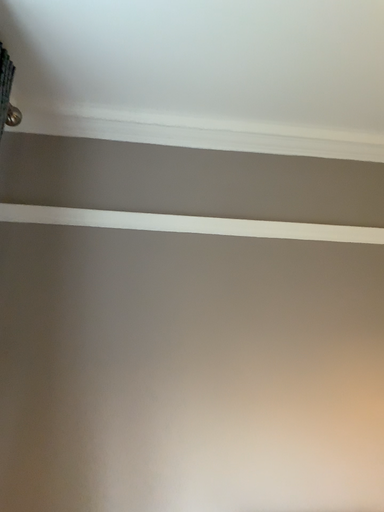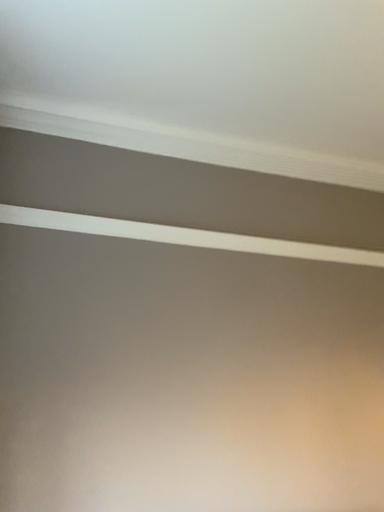
Question: Which way did the camera rotate in the video?

Choices:
 (A) rotated left
 (B) rotated right

Answer: (B)